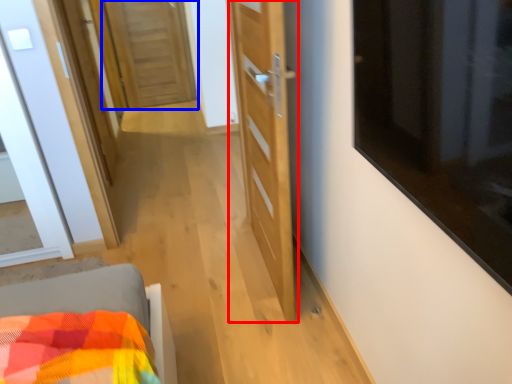
Question: Which point is closer to the camera, door (highlighted by a red box) or door (highlighted by a blue box)?

Choices:
 (A) door
 (B) door

Answer: (A)